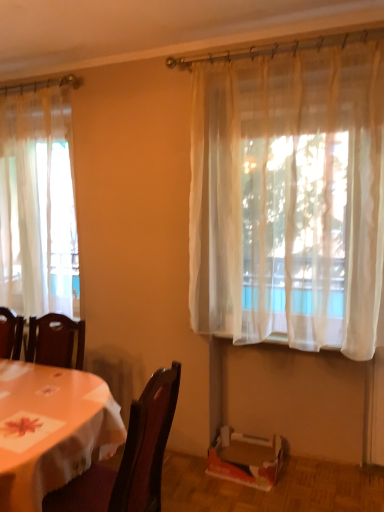
Question: In terms of size, does wooden table at lower left appear bigger or smaller than sheer white curtain at left, marked as the first curtain in a back-to-front arrangement?

Choices:
 (A) small
 (B) big

Answer: (B)

Question: Is wooden table at lower left taller or shorter than sheer white curtain at left, positioned as the 2th curtain in right-to-left order?

Choices:
 (A) short
 (B) tall

Answer: (A)

Question: Which of these objects is positioned farthest from the dark wood chair at lower left?

Choices:
 (A) sheer white curtain at left, the first curtain from the left
 (B) cardboard box at lower right
 (C) sheer white curtain at upper right, placed as the second curtain when sorted from back to front
 (D) wooden table at lower left

Answer: (A)

Question: Estimate the real-world distances between objects in this image. Which object is closer to the sheer white curtain at left, the first curtain from the left?

Choices:
 (A) wooden table at lower left
 (B) sheer white curtain at upper right, the 1th curtain positioned from the front
 (C) dark wood chair at lower left
 (D) cardboard box at lower right

Answer: (A)